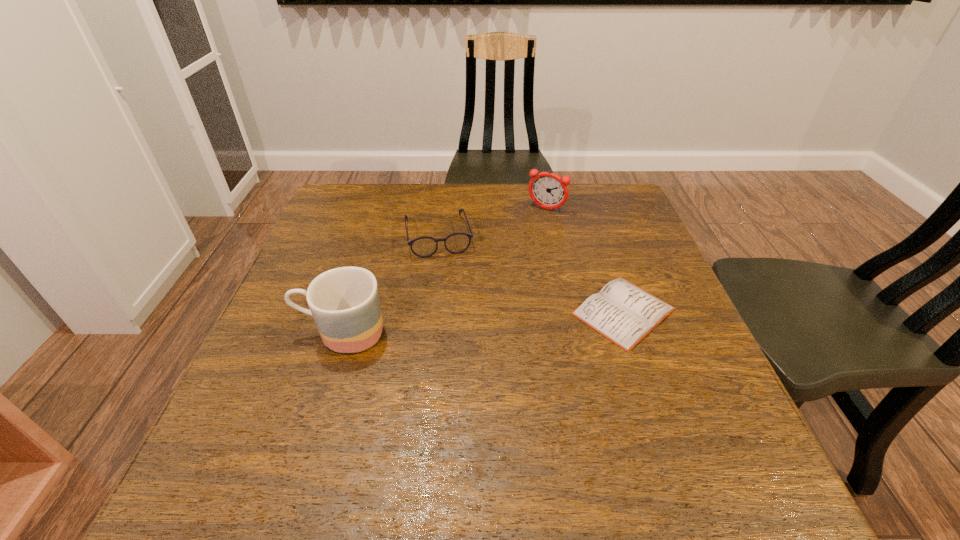
Image resolution: width=960 pixels, height=540 pixels. I want to click on free space on the desktop that is between the mug and the diary and is positioned on the front-facing side of the alarm clock, so click(474, 322).

Locate an element on the screen. The height and width of the screenshot is (540, 960). free spot on the desktop that is between the mug and the shortest object and is positioned on the front-facing side of the second shortest object is located at coordinates (458, 323).